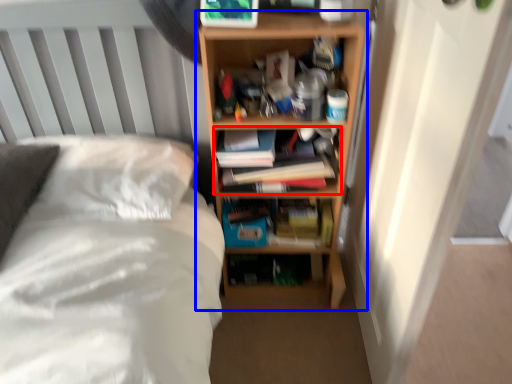
Question: Which object is further to the camera taking this photo, book (highlighted by a red box) or shelf (highlighted by a blue box)?

Choices:
 (A) book
 (B) shelf

Answer: (A)